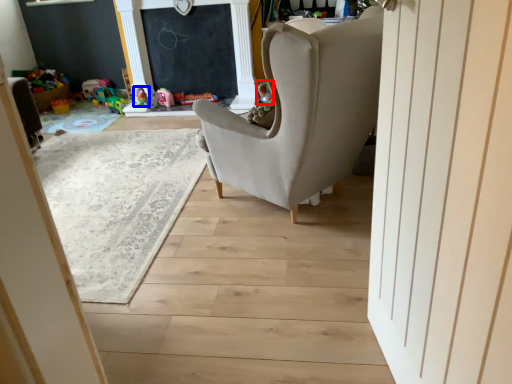
Question: Which of the following is the farthest to the observer, toy (highlighted by a red box) or toy (highlighted by a blue box)?

Choices:
 (A) toy
 (B) toy

Answer: (B)